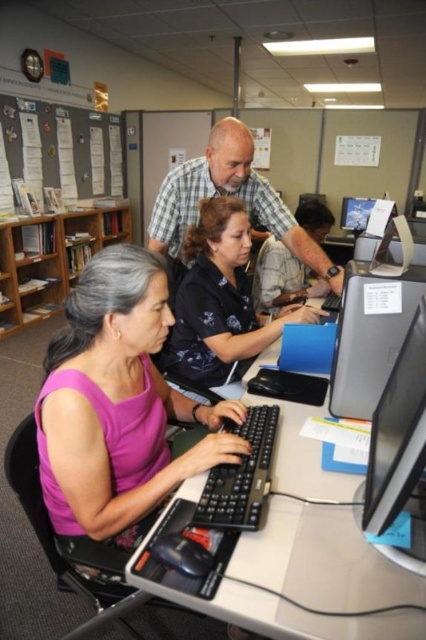
You are organizing a small event in this space and need to place a 1.5 meter wide table between the brown wood bookshelf at left and the satin silver monitor at center right. Based on their widths, will the table fit between them?

The brown wood bookshelf at left is wider than the satin silver monitor at center right. Since the table is 1.5 meters wide, it depends on the actual distance between them. However, the question only provides information about their widths, not the space between. Therefore, we cannot determine if the table will fit based on the given data.

You are a photographer trying to capture a closeup of the black satin blouse at center and the satin silver monitor at center right. Since you can only focus on one object at a time, which object should you focus on first to ensure the other is still in the frame?

You should focus on the black satin blouse at center first because it is positioned to the left of the satin silver monitor at center right, so if you focus on the leftmost object first, the right object will still be in the frame.

You are a person with a height of 1.7 meters standing in front of the satin black monitor at right. Can you comfortably view the screen without bending down or leaning forward excessively?

The satin black monitor at right is positioned 61.55 centimeters away from the viewer. At a height of 1.7 meters, this distance allows for a comfortable viewing experience without needing to bend down or lean forward excessively, as standard ergonomic guidelines recommend a distance of about an arm length, which is typically around 50 to 100 centimeters.